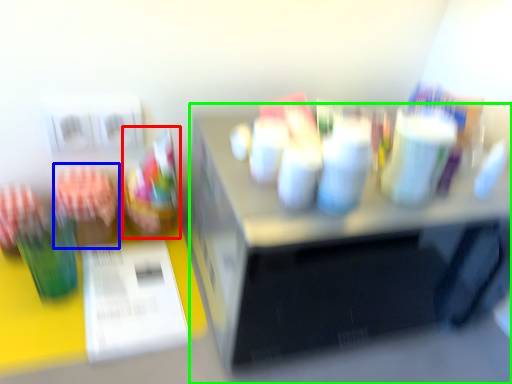
Question: Which object is the closest to the food (highlighted by a red box)? Choose among these: stationery (highlighted by a blue box) or desk (highlighted by a green box).

Choices:
 (A) stationery
 (B) desk

Answer: (A)